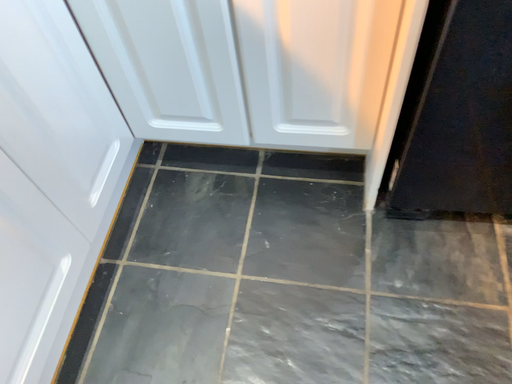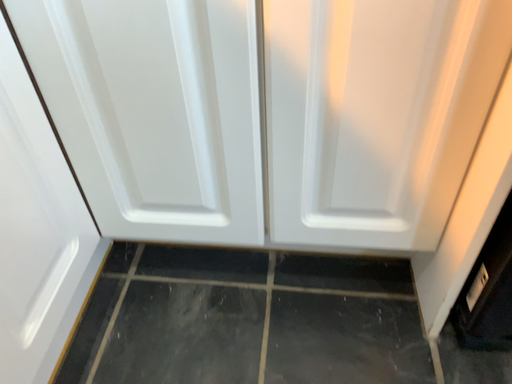
Question: How did the camera likely rotate when shooting the video?

Choices:
 (A) rotated downward
 (B) rotated upward

Answer: (B)